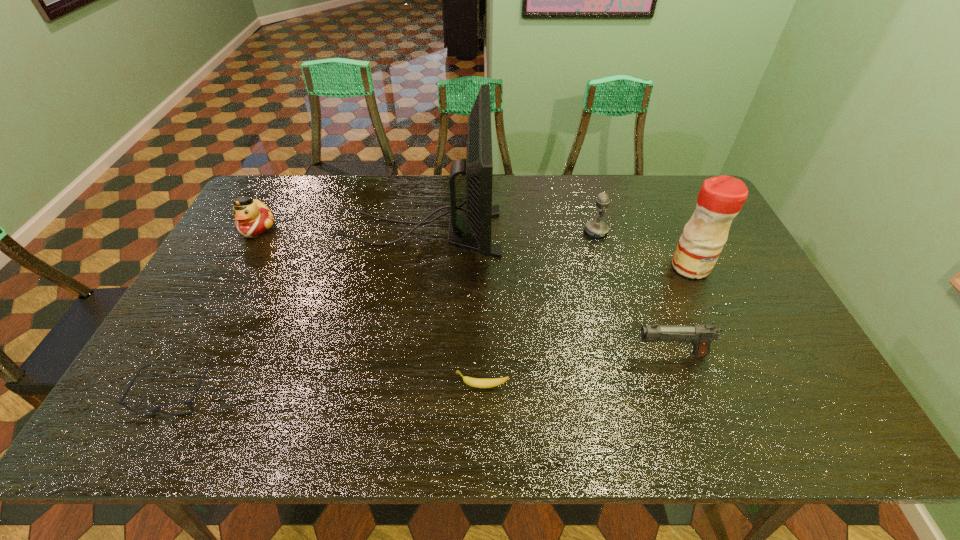
What are the coordinates of `free point between the banana and the rightmost object` in the screenshot? It's located at (587, 326).

Find the location of a particular element. The height and width of the screenshot is (540, 960). unoccupied area between the microphone and the gun is located at coordinates (634, 293).

This screenshot has height=540, width=960. I want to click on free area in between the rightmost object and the microphone, so click(643, 249).

Where is `object that is the second closest one to the computer monitor`? The height and width of the screenshot is (540, 960). object that is the second closest one to the computer monitor is located at coordinates (595, 228).

Where is `object that is the third closest one to the spectacles`? object that is the third closest one to the spectacles is located at coordinates (473, 382).

Image resolution: width=960 pixels, height=540 pixels. In order to click on free spot that satisfies the following two spatial constraints: 1. in the direction the gun is aimed; 2. on the front-facing side of the spectacles in this screenshot , I will do `click(684, 394)`.